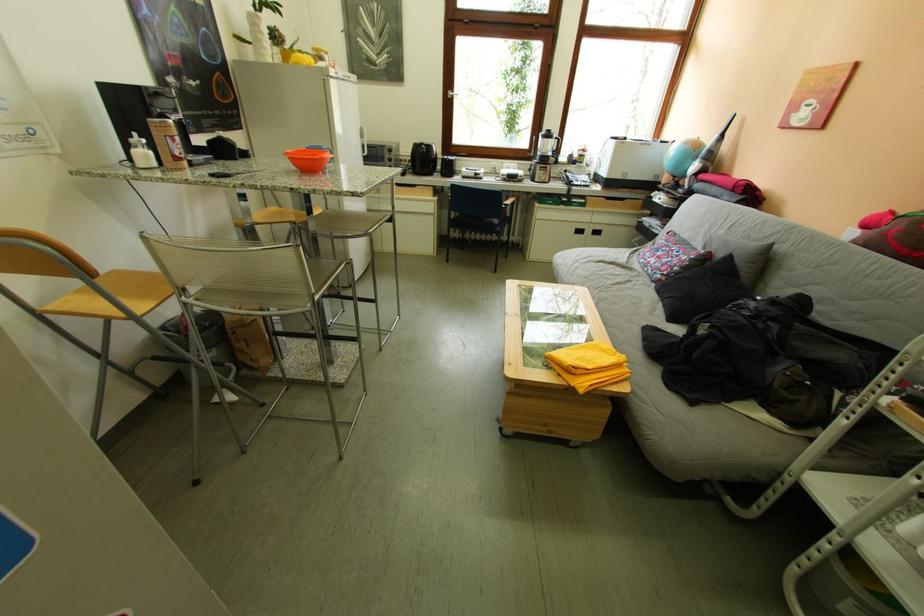
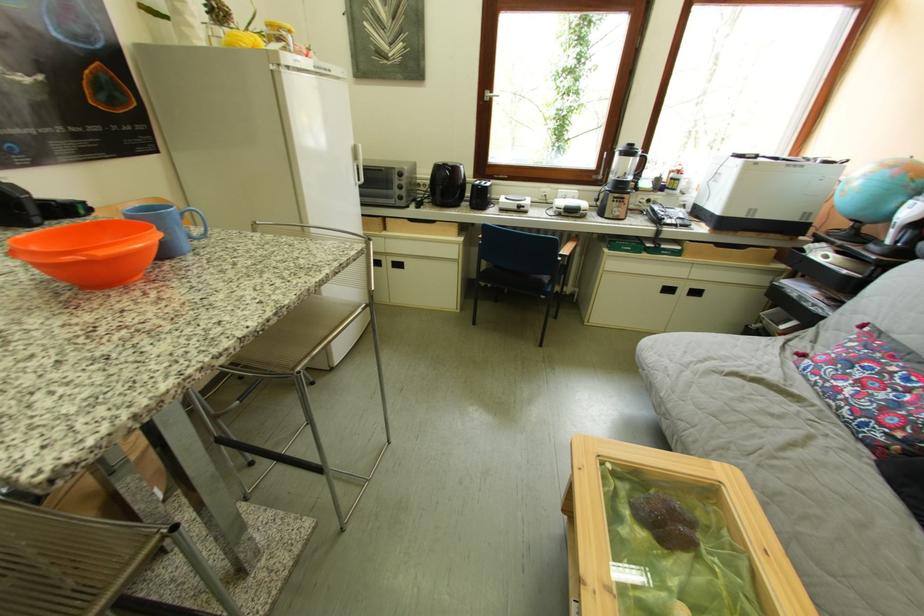
Find the pixel in the second image that matches (x=430, y=150) in the first image.

(451, 171)